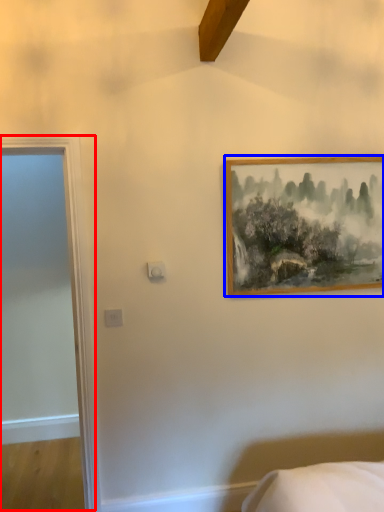
Question: Which object is closer to the camera taking this photo, door (highlighted by a red box) or picture frame (highlighted by a blue box)?

Choices:
 (A) door
 (B) picture frame

Answer: (A)